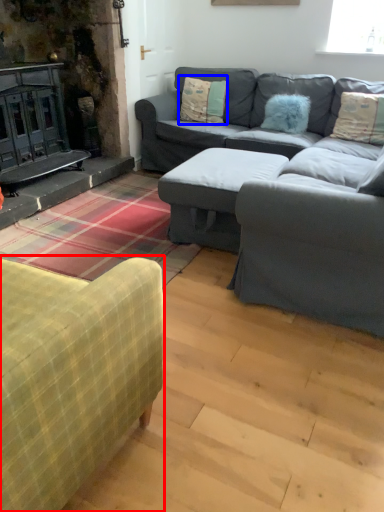
Question: Which object is further to the camera taking this photo, studio couch (highlighted by a red box) or pillow (highlighted by a blue box)?

Choices:
 (A) studio couch
 (B) pillow

Answer: (B)